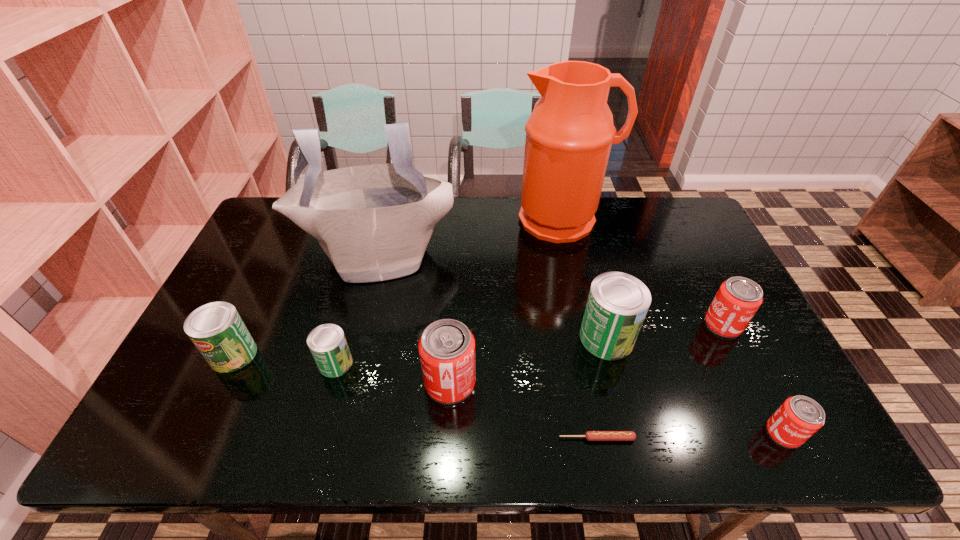
Where is `vacant area at the far edge of the desktop`? vacant area at the far edge of the desktop is located at coordinates (488, 238).

Image resolution: width=960 pixels, height=540 pixels. In the image, there is a desktop. What are the coordinates of `vacant area at the near edge` in the screenshot? It's located at (726, 420).

You are a GUI agent. You are given a task and a screenshot of the screen. Output one action in this format:
    pyautogui.click(x=<x>, y=<y>)
    Task: Click on the free space at the left edge
    This screenshot has width=960, height=540.
    Given the screenshot: What is the action you would take?
    pyautogui.click(x=242, y=269)

In the image, there is a desktop. Where is `vacant space at the right edge`? The width and height of the screenshot is (960, 540). vacant space at the right edge is located at coordinates (690, 251).

The width and height of the screenshot is (960, 540). What are the coordinates of `blank space at the far left corner of the desktop` in the screenshot? It's located at (264, 238).

Locate an element on the screen. free space between the orange water jug and the fifth can from right to left is located at coordinates (449, 291).

Identify the location of vacant area between the nearest can and the brown sausage. (690, 436).

At what (x,y) coordinates should I click in order to perform the action: click on vacant area that lies between the water jug and the sausage. Please return your answer as a coordinate pair (x, y). Looking at the image, I should click on (580, 329).

Find the location of `unoccupied position between the second green can from right to left and the water jug`. unoccupied position between the second green can from right to left and the water jug is located at coordinates (449, 291).

I want to click on unoccupied area between the nearest can and the orange water jug, so click(x=673, y=326).